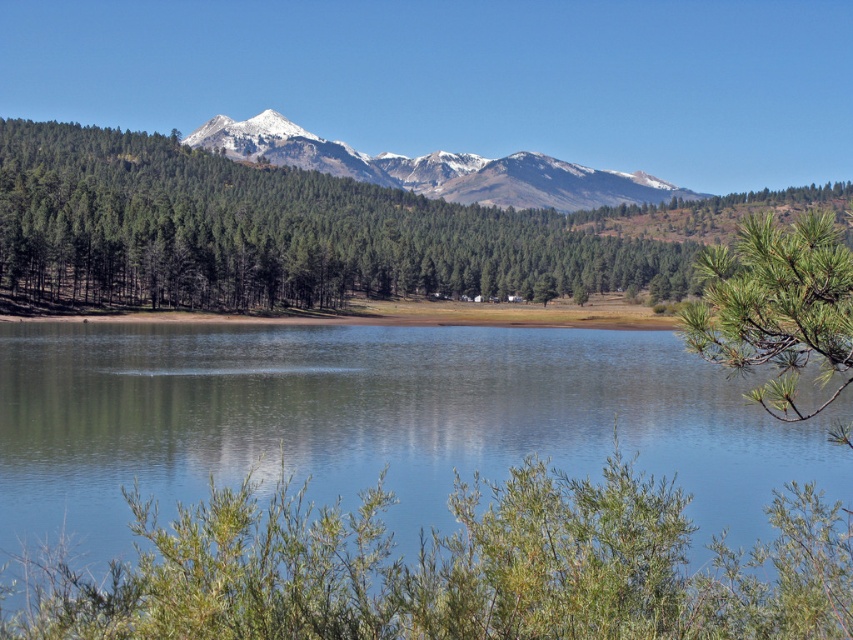
Is clear blue water at center wider than green needle-like leaves at right?

Correct, the width of clear blue water at center exceeds that of green needle-like leaves at right.

Can you confirm if clear blue water at center is shorter than green needle-like leaves at right?

Yes.

Does point (724, 452) come closer to viewer compared to point (816, 292)?

No, it is behind (816, 292).

What are the coordinates of `clear blue water at center` in the screenshot? It's located at (409, 484).

Which of these two, green matte tree at center or snowy rocky mountains at center, stands shorter?

Standing shorter between the two is snowy rocky mountains at center.

Does point (317, 304) lie in front of point (463, 161)?

Yes.

Does point (659, 284) come in front of point (471, 179)?

Yes, point (659, 284) is in front of point (471, 179).

Image resolution: width=853 pixels, height=640 pixels. I want to click on green matte tree at center, so click(273, 234).

Which of these two, clear blue water at center or green matte tree at center, stands shorter?

clear blue water at center is shorter.

Who is more distant from viewer, [325,572] or [605,212]?

Point [605,212]

Locate an element on the screen. Image resolution: width=853 pixels, height=640 pixels. clear blue water at center is located at coordinates (x=409, y=484).